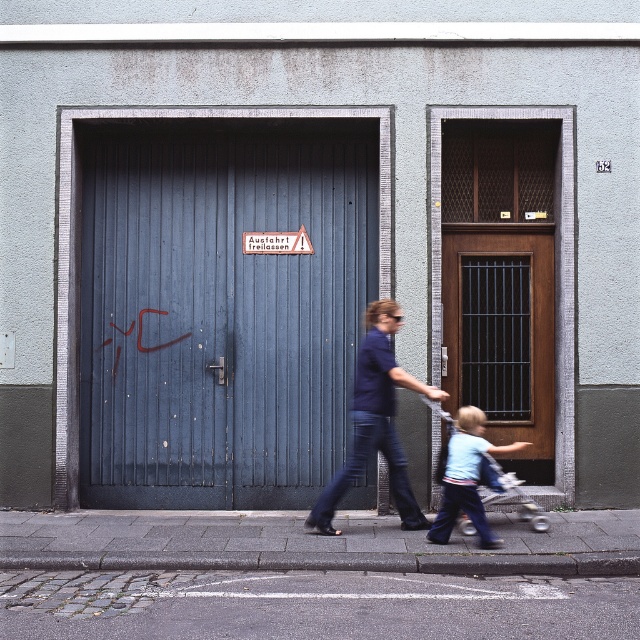
Question: Is cobblestone pavement at lower left smaller than wooden door with metal bars at right?

Choices:
 (A) yes
 (B) no

Answer: (A)

Question: Which of the following is the closest to the observer?

Choices:
 (A) (550, 272)
 (B) (476, 481)
 (C) (275, 586)
 (D) (19, 522)

Answer: (C)

Question: From the image, what is the correct spatial relationship of blue wooden garage door at left in relation to wooden door with metal bars at right?

Choices:
 (A) left
 (B) right

Answer: (A)

Question: Which object is closer to the camera taking this photo?

Choices:
 (A) wooden door with metal bars at right
 (B) cobblestone pavement at lower left
 (C) blue wooden garage door at left
 (D) dark blue jeans at center

Answer: (B)

Question: Which point is closer to the camera taking this photo?

Choices:
 (A) (387, 420)
 (B) (492, 406)

Answer: (A)

Question: Can you confirm if blue wooden garage door at left is bigger than light blue denim pants at lower center?

Choices:
 (A) no
 (B) yes

Answer: (B)